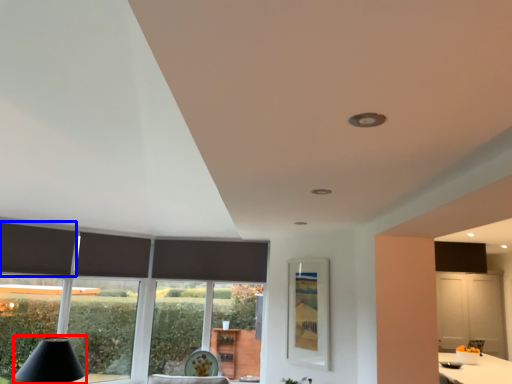
Question: Among these objects, which one is farthest to the camera, table lamp (highlighted by a red box) or curtain (highlighted by a blue box)?

Choices:
 (A) table lamp
 (B) curtain

Answer: (B)